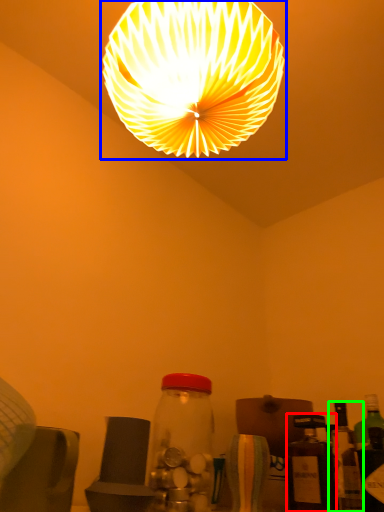
Question: Which object is the farthest from bottle (highlighted by a red box)? Choose among these: lamp (highlighted by a blue box) or bottle (highlighted by a green box).

Choices:
 (A) lamp
 (B) bottle

Answer: (A)